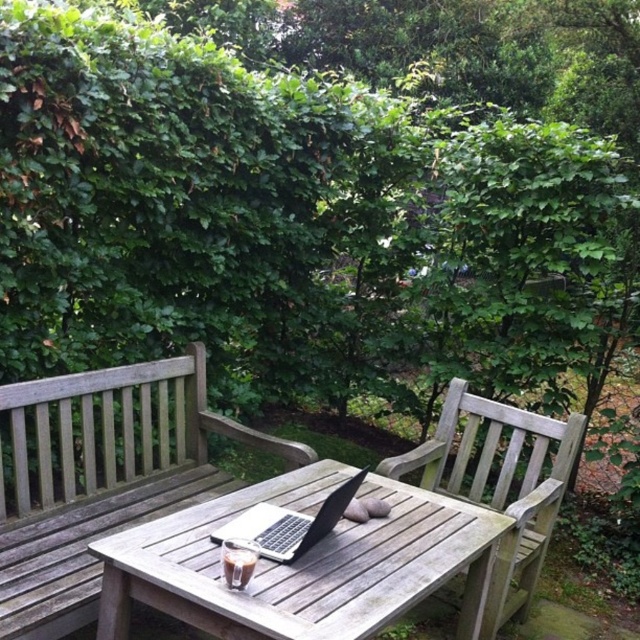
Does wooden bench at center appear under weathered wood park bench at center?

Actually, wooden bench at center is above weathered wood park bench at center.

What do you see at coordinates (99, 477) in the screenshot? I see `wooden bench at center` at bounding box center [99, 477].

Identify the location of wooden bench at center. This screenshot has height=640, width=640. (99, 477).

Is wooden picnic table at center below weathered wood park bench at center?

Indeed, wooden picnic table at center is positioned under weathered wood park bench at center.

Between point (296, 609) and point (432, 456), which one is positioned behind?

Positioned behind is point (432, 456).

The height and width of the screenshot is (640, 640). In order to click on wooden picnic table at center in this screenshot , I will do `click(304, 563)`.

Who is positioned more to the right, wooden bench at center or wooden picnic table at center?

From the viewer's perspective, wooden picnic table at center appears more on the right side.

Who is shorter, wooden bench at center or wooden picnic table at center?

With less height is wooden picnic table at center.

Find the location of `wooden bench at center`. wooden bench at center is located at coordinates (99, 477).

Image resolution: width=640 pixels, height=640 pixels. Identify the location of wooden bench at center. (99, 477).